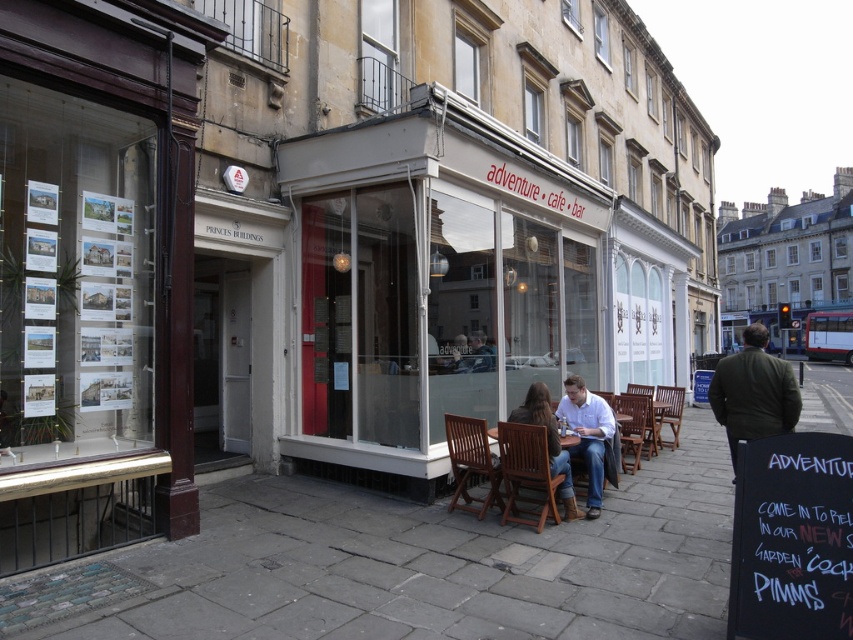
Between black chalkboard at lower right and dark green jacket at center, which one is positioned lower?

dark green jacket at center is lower down.

Measure the distance between black chalkboard at lower right and camera.

black chalkboard at lower right is 10.92 feet away from camera.

Does point (846, 625) come in front of point (741, 372)?

Yes.

Where is `black chalkboard at lower right`? Image resolution: width=853 pixels, height=640 pixels. black chalkboard at lower right is located at coordinates (792, 538).

Can you confirm if black chalkboard at lower right is smaller than wooden chairs at center?

Correct, black chalkboard at lower right occupies less space than wooden chairs at center.

Which of these two, black chalkboard at lower right or wooden chairs at center, stands taller?

wooden chairs at center is taller.

Does point (793, 476) come farther from viewer compared to point (608, 432)?

No, it is not.

The height and width of the screenshot is (640, 853). Find the location of `black chalkboard at lower right`. black chalkboard at lower right is located at coordinates (792, 538).

Which is in front, point (753, 371) or point (607, 412)?

Positioned in front is point (753, 371).

Does point (726, 356) come closer to viewer compared to point (607, 433)?

No, it is behind (607, 433).

Locate an element on the screen. dark green jacket at center is located at coordinates (753, 392).

Where is `dark green jacket at center`? Image resolution: width=853 pixels, height=640 pixels. dark green jacket at center is located at coordinates (753, 392).